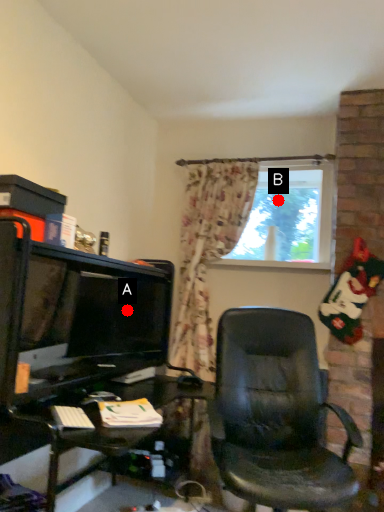
Question: Two points are circled on the image, labeled by A and B beside each circle. Which of the following is the farthest from the observer?

Choices:
 (A) A is further
 (B) B is further

Answer: (B)